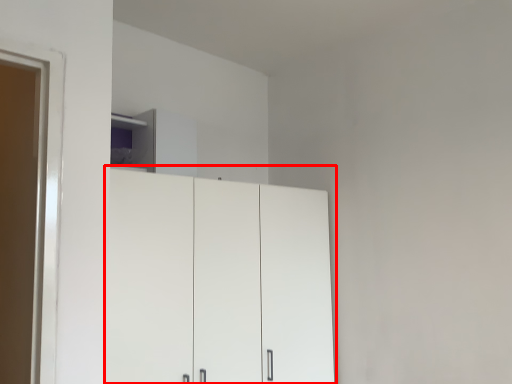
Question: Observing the image, what is the correct spatial positioning of cupboard (annotated by the red box) in reference to cabinetry?

Choices:
 (A) left
 (B) right

Answer: (B)